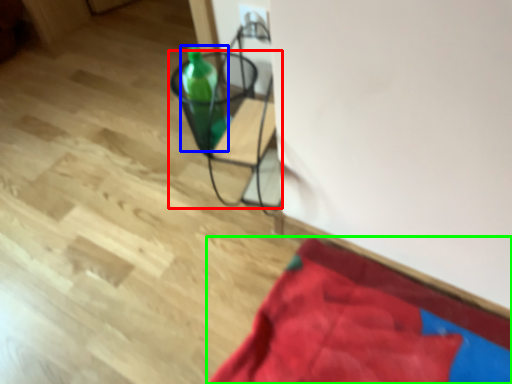
Question: Which object is the farthest from furniture (highlighted by a red box)? Choose among these: bottle (highlighted by a blue box) or blanket (highlighted by a green box).

Choices:
 (A) bottle
 (B) blanket

Answer: (B)